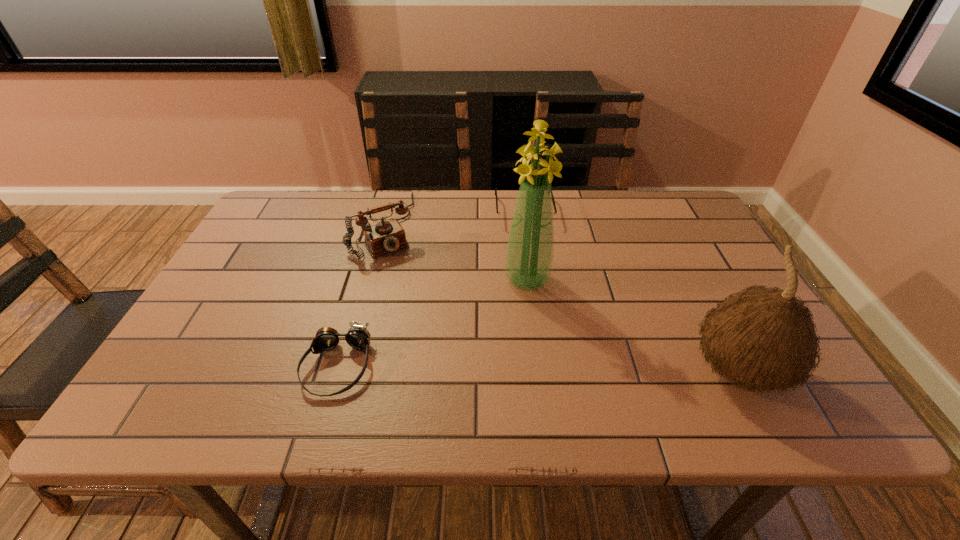
Where is `goggles`? The image size is (960, 540). goggles is located at coordinates (358, 337).

At what (x,y) coordinates should I click in order to perform the action: click on the rightmost object. Please return your answer as a coordinate pair (x, y). This screenshot has height=540, width=960. Looking at the image, I should click on (763, 338).

Where is `the fourth shortest object`? the fourth shortest object is located at coordinates (763, 338).

This screenshot has width=960, height=540. In order to click on the third farthest object in this screenshot , I will do `click(529, 255)`.

Where is `bouquet`? bouquet is located at coordinates (529, 255).

This screenshot has height=540, width=960. Identify the location of telephone. (386, 236).

Locate an element on the screen. spectacles is located at coordinates (505, 217).

Locate an element on the screen. The height and width of the screenshot is (540, 960). vacant space positioned 0.130m on the front-facing side of the tallest object is located at coordinates (519, 335).

Where is `vacant space located on the front-facing side of the tallest object`? vacant space located on the front-facing side of the tallest object is located at coordinates (516, 356).

At what (x,y) coordinates should I click in order to perform the action: click on vacant space located 0.130m on the front-facing side of the tallest object. Please return your answer as a coordinate pair (x, y). Looking at the image, I should click on (519, 335).